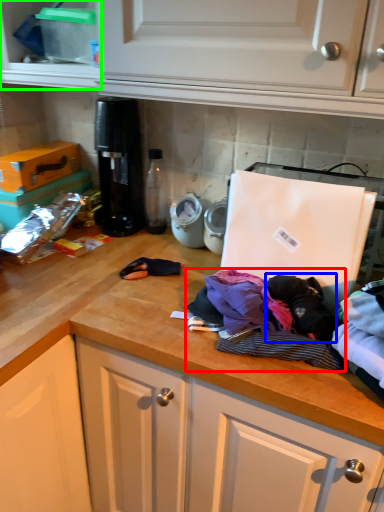
Question: Which is nearer to the clothing (highlighted by a red box)? clothing (highlighted by a blue box) or cabinetry (highlighted by a green box).

Choices:
 (A) clothing
 (B) cabinetry

Answer: (A)